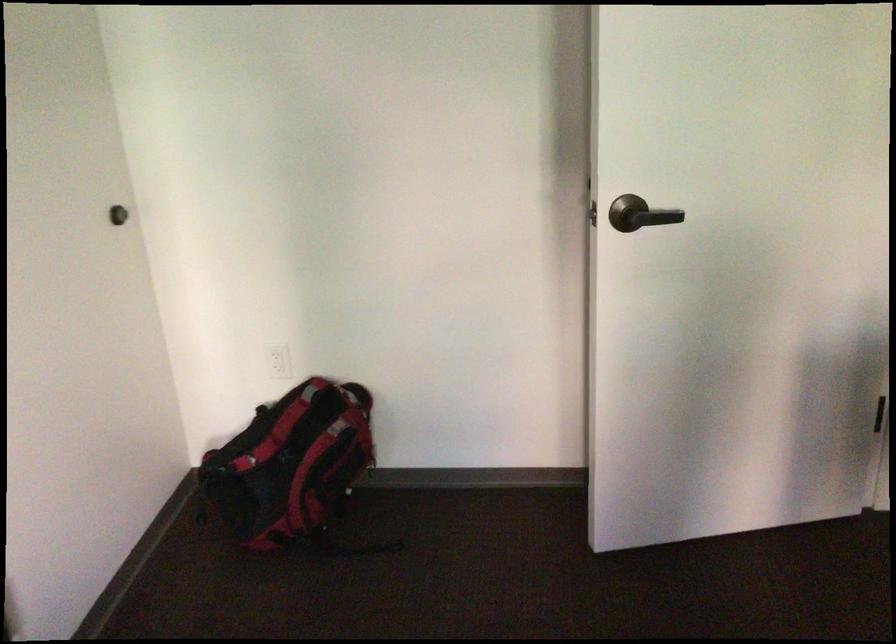
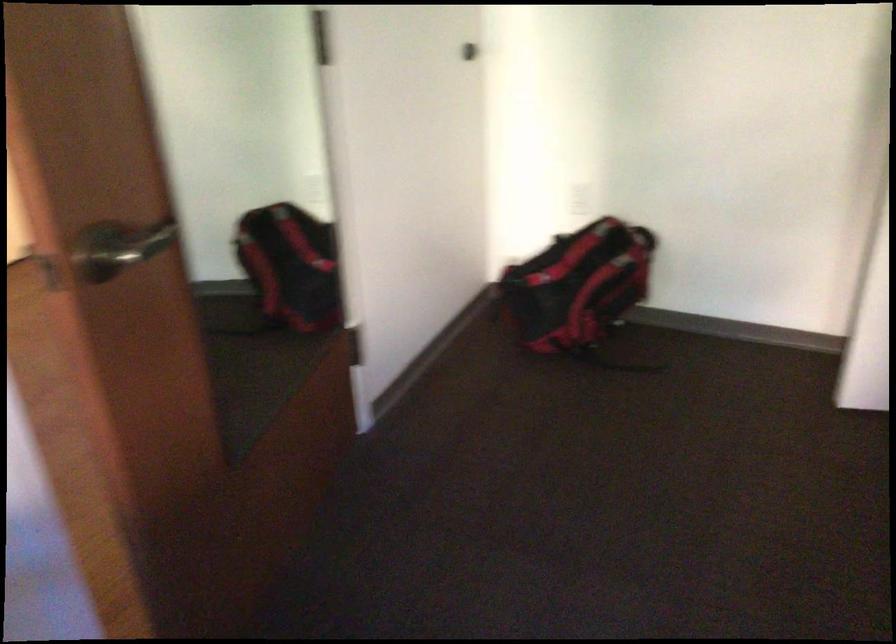
Question: The images are taken continuously from a first-person perspective. In which direction are you moving?

Choices:
 (A) Left
 (B) Right
 (C) Forward
 (D) Backward

Answer: (D)